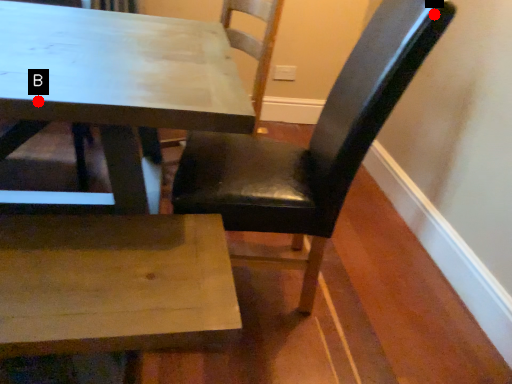
Question: Two points are circled on the image, labeled by A and B beside each circle. Which of the following is the closest to the observer?

Choices:
 (A) A is closer
 (B) B is closer

Answer: (B)